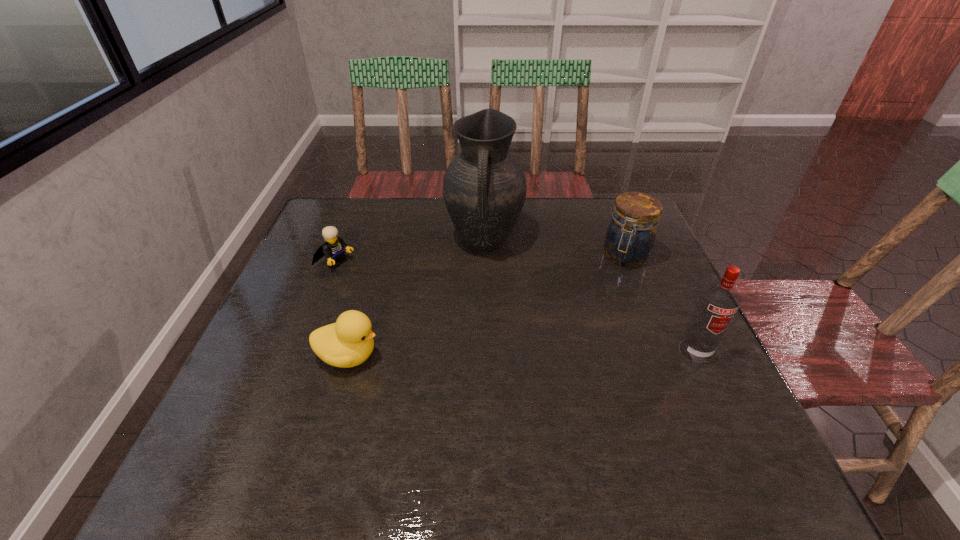
Find the location of a particular element. duck is located at coordinates (349, 342).

The width and height of the screenshot is (960, 540). I want to click on vodka, so click(717, 304).

What are the coordinates of `Lego` in the screenshot? It's located at (333, 249).

The image size is (960, 540). What are the coordinates of `the third object from left to right` in the screenshot? It's located at (484, 189).

The height and width of the screenshot is (540, 960). What are the coordinates of `the tallest object` in the screenshot? It's located at tap(484, 189).

Locate an element on the screen. the third tallest object is located at coordinates (630, 237).

The height and width of the screenshot is (540, 960). In order to click on vacant space located on the front-facing side of the duck in this screenshot , I will do `click(559, 356)`.

This screenshot has width=960, height=540. I want to click on free point located on the front label of the vodka, so click(x=723, y=409).

You are a GUI agent. You are given a task and a screenshot of the screen. Output one action in this format:
    pyautogui.click(x=<x>, y=<y>)
    Task: Click on the free space located on the front-facing side of the Lego
    Image resolution: width=960 pixels, height=540 pixels.
    Given the screenshot: What is the action you would take?
    pyautogui.click(x=430, y=309)

Find the location of a particular element. free space located on the front-facing side of the Lego is located at coordinates pyautogui.click(x=408, y=298).